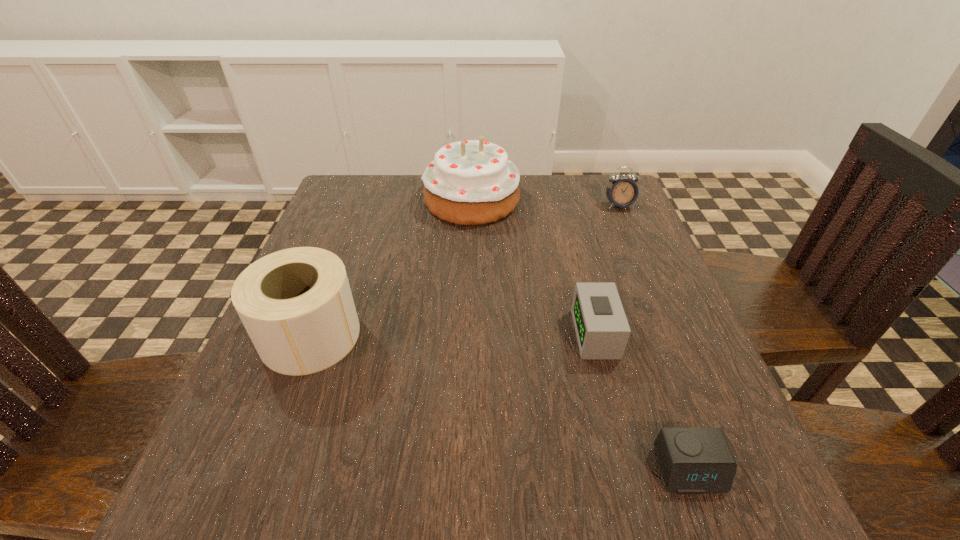
Identify the location of vacant space situated 0.130m on the front of the second object from left to right. (470, 263).

Where is `free location located on the front of the fourth shortest object`? The height and width of the screenshot is (540, 960). free location located on the front of the fourth shortest object is located at coordinates (268, 450).

Identify the location of free spot located 0.180m on the face of the farthest alarm clock. click(x=641, y=258).

Locate an element on the screen. The height and width of the screenshot is (540, 960). vacant space located 0.350m on the front-facing side of the fourth tallest object is located at coordinates (384, 334).

You are a GUI agent. You are given a task and a screenshot of the screen. Output one action in this format:
    pyautogui.click(x=<x>, y=<y>)
    Task: Click on the vacant space located on the front-facing side of the fourth tallest object
    This screenshot has width=960, height=540.
    Given the screenshot: What is the action you would take?
    [x=368, y=334]

The image size is (960, 540). What are the coordinates of `vacant space located on the front-facing side of the fourth tallest object` in the screenshot? It's located at (461, 334).

Image resolution: width=960 pixels, height=540 pixels. In order to click on cake located at the far edge in this screenshot , I will do `click(473, 182)`.

This screenshot has width=960, height=540. In order to click on alarm clock present at the far edge in this screenshot , I will do `click(623, 192)`.

Where is `object present at the near edge`? The width and height of the screenshot is (960, 540). object present at the near edge is located at coordinates (693, 460).

This screenshot has height=540, width=960. In order to click on object that is at the left edge in this screenshot , I will do `click(296, 305)`.